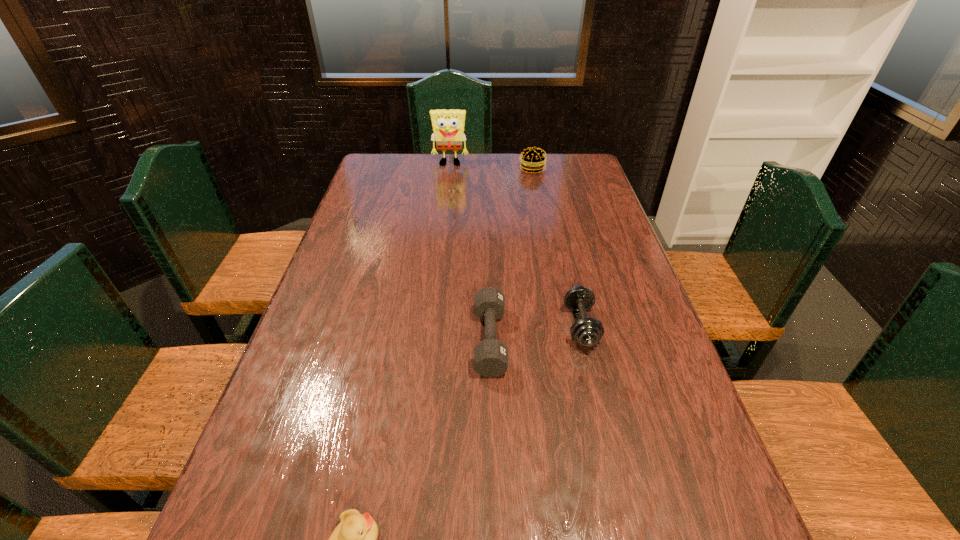
Where is `free space that is in between the left dumbbell and the right dumbbell`? The height and width of the screenshot is (540, 960). free space that is in between the left dumbbell and the right dumbbell is located at coordinates (536, 333).

Where is `free space that is in between the right dumbbell and the third object from left to right`? Image resolution: width=960 pixels, height=540 pixels. free space that is in between the right dumbbell and the third object from left to right is located at coordinates (536, 333).

Locate an element on the screen. Image resolution: width=960 pixels, height=540 pixels. free spot between the left dumbbell and the sponge is located at coordinates (470, 252).

The width and height of the screenshot is (960, 540). What are the coordinates of `free point between the sponge and the right dumbbell` in the screenshot? It's located at (516, 245).

Locate which object is the second closest to the right dumbbell. Please provide its 2D coordinates. Your answer should be formatted as a tuple, i.e. [(x, y)], where the tuple contains the x and y coordinates of a point satisfying the conditions above.

[(354, 539)]

The height and width of the screenshot is (540, 960). Identify the location of object that ranks as the third closest to the right dumbbell. (532, 160).

The height and width of the screenshot is (540, 960). Identify the location of free space that satisfies the following two spatial constraints: 1. on the face of the third object from left to right; 2. on the left side of the sponge. (430, 340).

Find the location of a particular element. This screenshot has width=960, height=540. vacant space that satisfies the following two spatial constraints: 1. on the face of the right dumbbell; 2. on the right side of the sponge is located at coordinates (432, 326).